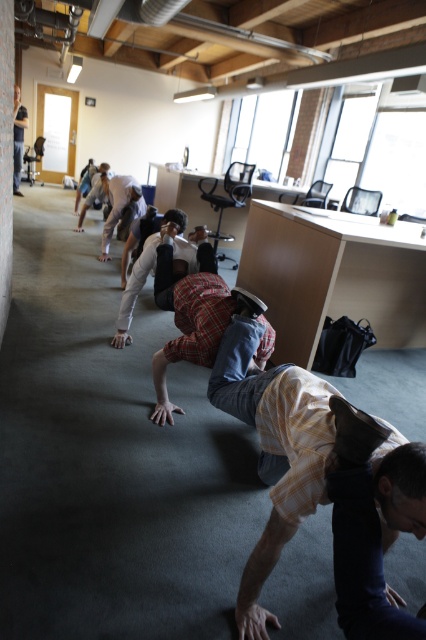
Who is more distant from viewer, (276,556) or (19,168)?

The point (19,168) is more distant.

Between yellow plaid shorts at lower center and matte black laptop at upper left, which one appears on the left side from the viewer's perspective?

matte black laptop at upper left

You are a GUI agent. You are given a task and a screenshot of the screen. Output one action in this format:
    pyautogui.click(x=<x>, y=<y>)
    Task: Click on the yellow plaid shorts at lower center
    
    Given the screenshot: What is the action you would take?
    pyautogui.click(x=271, y=444)

The width and height of the screenshot is (426, 640). What are the coordinates of `yellow plaid shorts at lower center` in the screenshot? It's located at (271, 444).